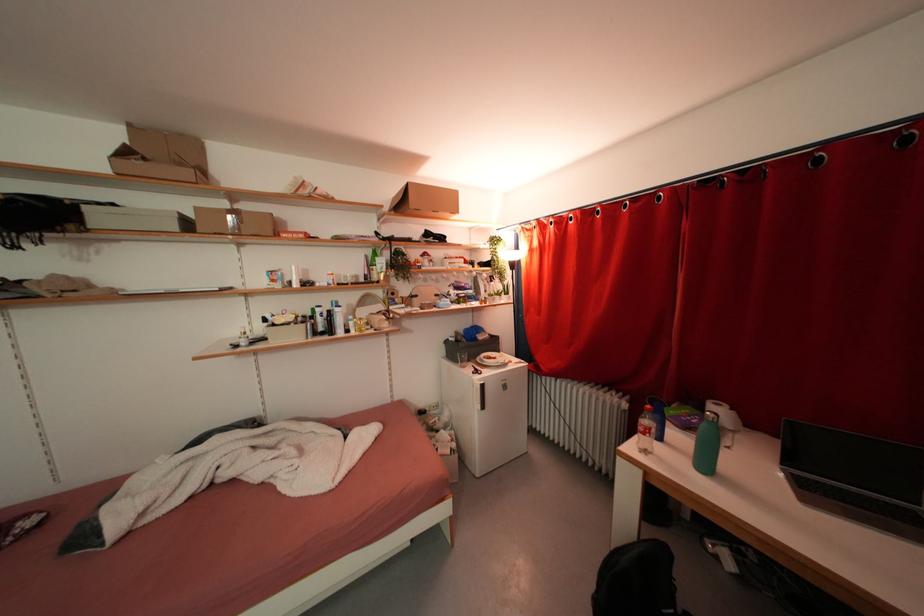
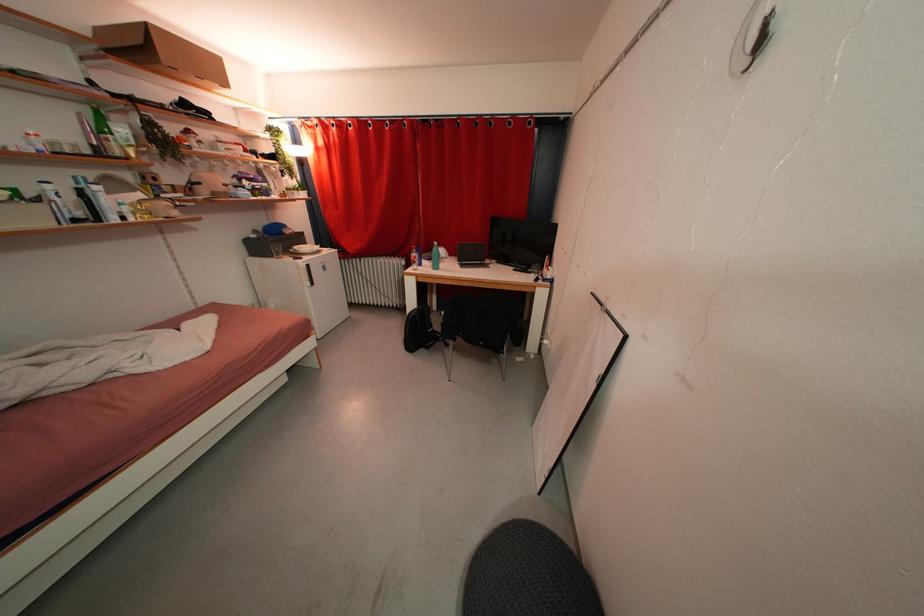
Where in the second image is the point corresponding to pixel 694 432 from the first image?

(435, 262)